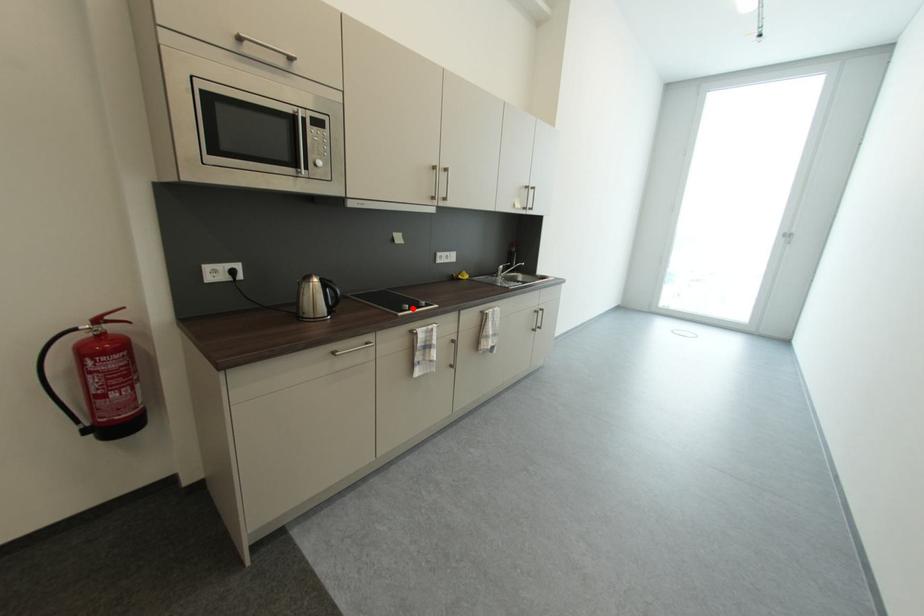
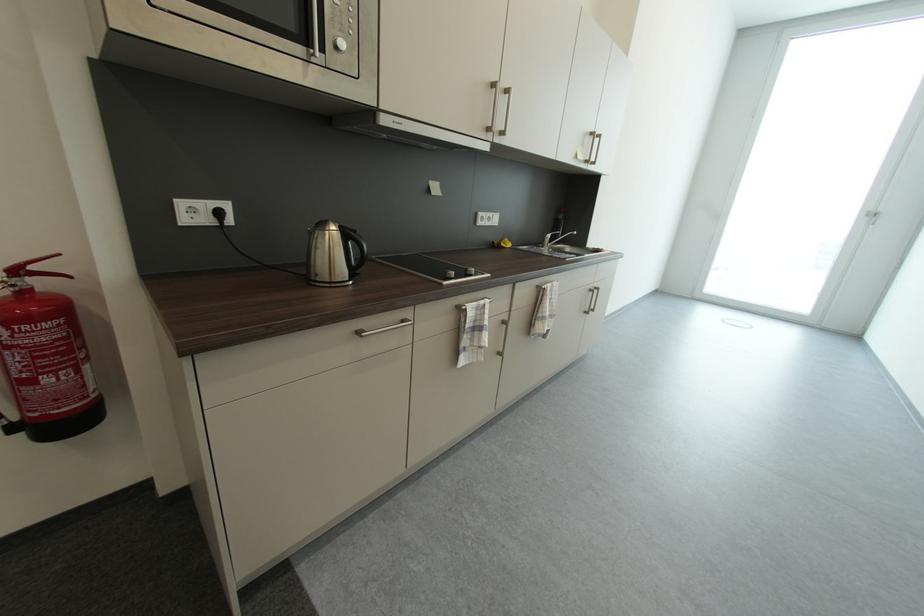
Question: I am providing you with two images of the same scene from different viewpoints. A red point is marked on the first image. Is the red point's position out of view in image 2?

Choices:
 (A) Yes
 (B) No

Answer: (B)